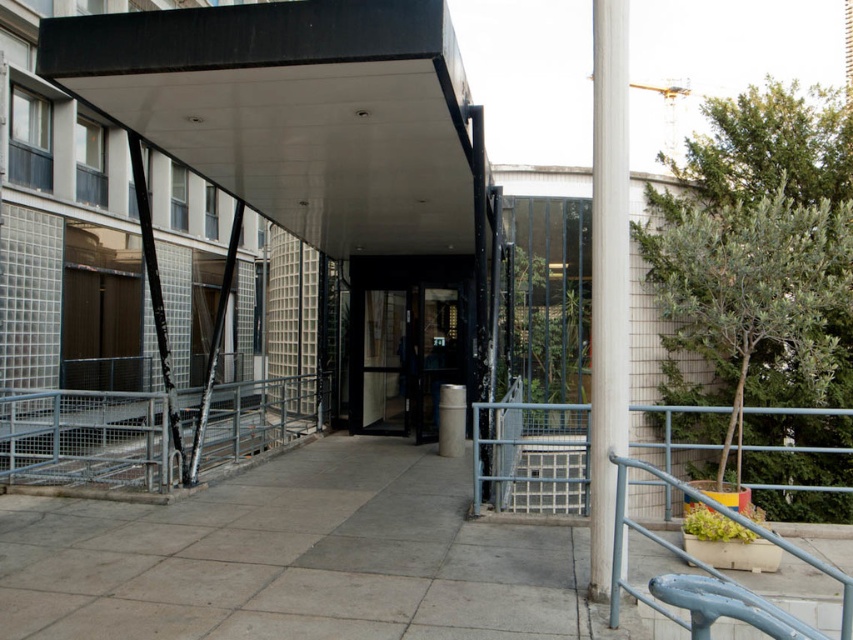
Which is above, transparent glass door at center or white glossy pole at right?

white glossy pole at right is above.

Can you confirm if transparent glass door at center is positioned below white glossy pole at right?

Yes.

Who is more distant from viewer, (393, 289) or (614, 148)?

Positioned behind is point (393, 289).

This screenshot has height=640, width=853. I want to click on transparent glass door at center, so click(405, 339).

How distant is white glossy pole at right from metallic grid stair at center?

white glossy pole at right and metallic grid stair at center are 7.66 meters apart from each other.

Can you confirm if white glossy pole at right is positioned to the right of metallic grid stair at center?

In fact, white glossy pole at right is to the left of metallic grid stair at center.

You are a GUI agent. You are given a task and a screenshot of the screen. Output one action in this format:
    pyautogui.click(x=<x>, y=<y>)
    Task: Click on the white glossy pole at right
    This screenshot has height=640, width=853.
    Given the screenshot: What is the action you would take?
    pyautogui.click(x=608, y=280)

Does point (76, 435) come in front of point (459, 282)?

That is True.

The height and width of the screenshot is (640, 853). I want to click on metal/grey rail at lower left, so click(x=86, y=440).

Where is `metal/grey rail at lower left`? This screenshot has height=640, width=853. metal/grey rail at lower left is located at coordinates (86, 440).